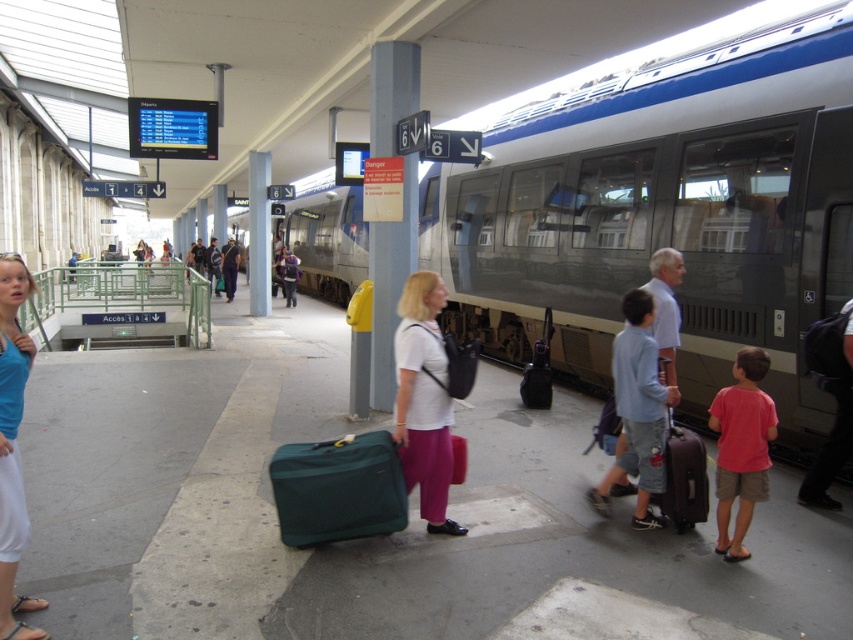
Question: Estimate the real-world distances between objects in this image. Which object is closer to the pink cotton shirt at center?

Choices:
 (A) blue cotton tank top at lower left
 (B) purple fabric backpack at center
 (C) matte brown suitcase at center

Answer: (C)

Question: Does green fabric suitcase at center have a lesser width compared to matte brown suitcase at center?

Choices:
 (A) yes
 (B) no

Answer: (B)

Question: Observing the image, what is the correct spatial positioning of matte brown suitcase at center in reference to purple fabric backpack at center?

Choices:
 (A) above
 (B) below

Answer: (B)

Question: Among these objects, which one is farthest from the camera?

Choices:
 (A) matte brown suitcase at center
 (B) metallic gray pillar at center

Answer: (B)

Question: Can you confirm if blue cotton tank top at lower left is thinner than purple fabric backpack at center?

Choices:
 (A) no
 (B) yes

Answer: (B)

Question: Which object is closer to the camera taking this photo?

Choices:
 (A) purple fabric backpack at center
 (B) pink cotton shirt at center

Answer: (B)